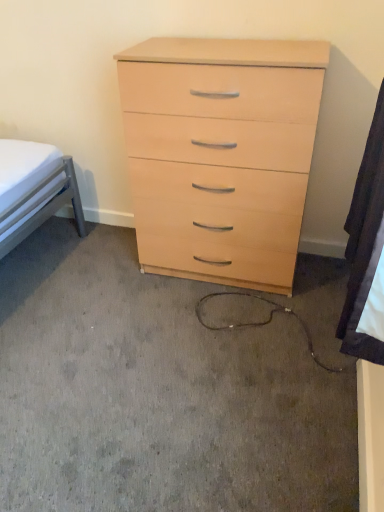
Question: Is light wood/finish chest of drawers at center situated inside white fabric at lower right or outside?

Choices:
 (A) outside
 (B) inside

Answer: (A)

Question: In terms of width, does light wood/finish chest of drawers at center look wider or thinner when compared to white fabric at lower right?

Choices:
 (A) wide
 (B) thin

Answer: (A)

Question: In the image, is light wood/finish chest of drawers at center positioned in front of or behind white fabric at lower right?

Choices:
 (A) behind
 (B) front

Answer: (A)

Question: Based on their sizes in the image, would you say white fabric at lower right is bigger or smaller than light wood/finish chest of drawers at center?

Choices:
 (A) small
 (B) big

Answer: (A)

Question: Looking at their shapes, would you say white fabric at lower right is wider or thinner than light wood/finish chest of drawers at center?

Choices:
 (A) thin
 (B) wide

Answer: (A)

Question: From the image's perspective, is white fabric at lower right above or below light wood/finish chest of drawers at center?

Choices:
 (A) below
 (B) above

Answer: (A)

Question: Do you think white fabric at lower right is within light wood/finish chest of drawers at center, or outside of it?

Choices:
 (A) inside
 (B) outside

Answer: (B)